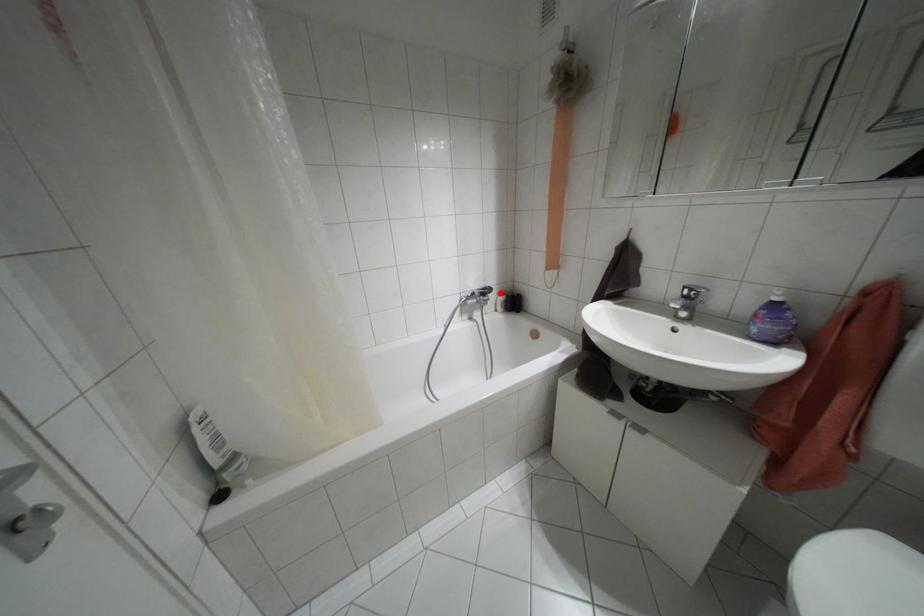
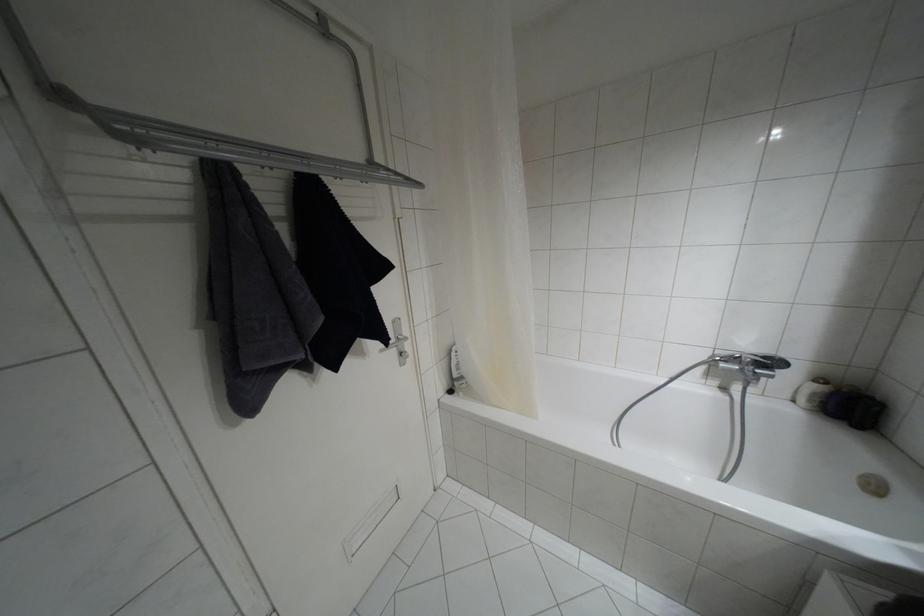
Question: I am providing you with two images of the same scene from different viewpoints. A red point is marked on the first image. At the location where the point appears in image 1, is it still visible in image 2?

Choices:
 (A) Yes
 (B) No

Answer: (A)